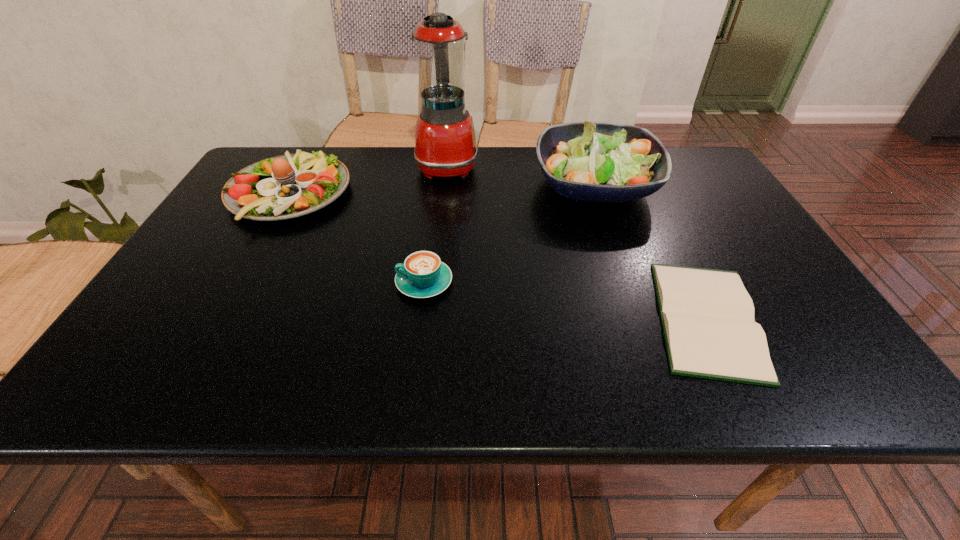
Image resolution: width=960 pixels, height=540 pixels. Identify the location of food processor. (445, 143).

The height and width of the screenshot is (540, 960). In order to click on the fourth shortest object in this screenshot , I will do `click(592, 161)`.

The width and height of the screenshot is (960, 540). I want to click on the right salad plate, so click(x=592, y=161).

At what (x,y) coordinates should I click in order to perform the action: click on the left salad plate. Please return your answer as a coordinate pair (x, y). Looking at the image, I should click on (291, 185).

The width and height of the screenshot is (960, 540). I want to click on the leftmost object, so (291, 185).

Where is `the second shortest object`? the second shortest object is located at coordinates [423, 275].

This screenshot has width=960, height=540. I want to click on the shortest object, so click(707, 315).

Find the location of a particular element. The width and height of the screenshot is (960, 540). free location located on the controls of the tallest object is located at coordinates (573, 166).

Where is `vacant space located 0.090m on the left of the taller salad plate`? vacant space located 0.090m on the left of the taller salad plate is located at coordinates (502, 185).

At what (x,y) coordinates should I click in order to perform the action: click on free spot located on the back of the third shortest object. Please return your answer as a coordinate pair (x, y). The height and width of the screenshot is (540, 960). Looking at the image, I should click on (313, 151).